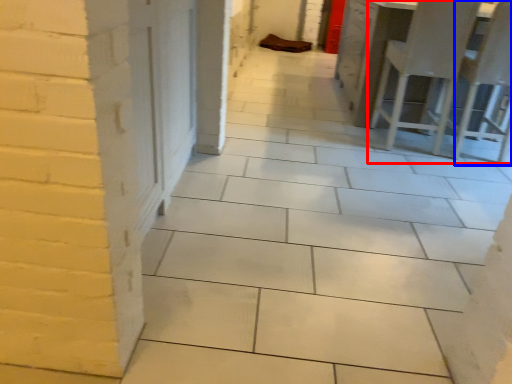
Question: Which point is closer to the camera, furniture (highlighted by a red box) or chair (highlighted by a blue box)?

Choices:
 (A) furniture
 (B) chair

Answer: (B)